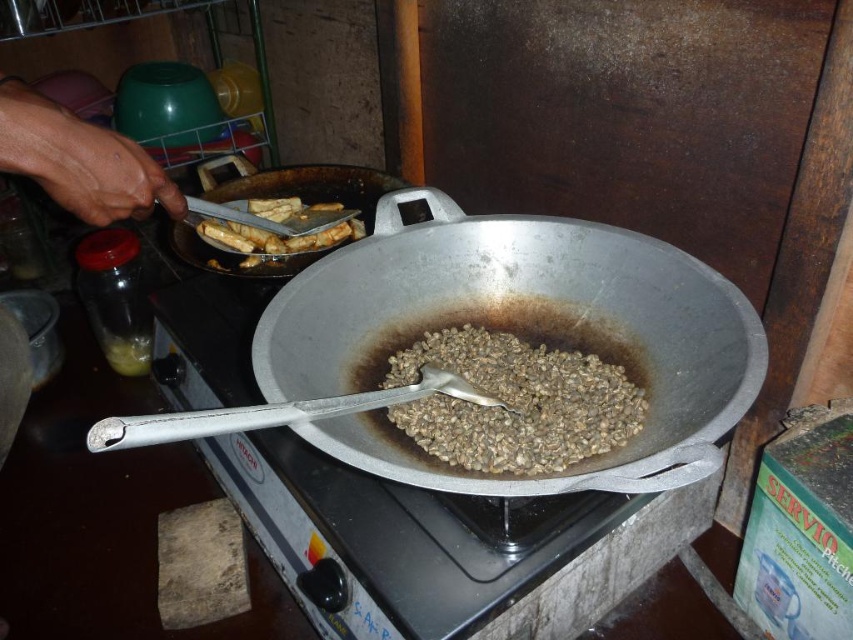
You are a chef preparing a dish and need to move the shiny silver wok at center and the brown matte beans at center to different locations. If you want to place them so that the beans are to the right of the wok, is their current arrangement already correct?

The shiny silver wok at center is positioned on the left side of brown matte beans at center, so their current arrangement already has the beans to the right of the wok.

You are a chef preparing a dish and need to know which item is more suitable for holding ingredients. Based on their sizes, which one is wider between the brown matte beans at center and the silver metallic frying pan at center?

The silver metallic frying pan at center is wider than the brown matte beans at center, so it would be more suitable for holding ingredients.